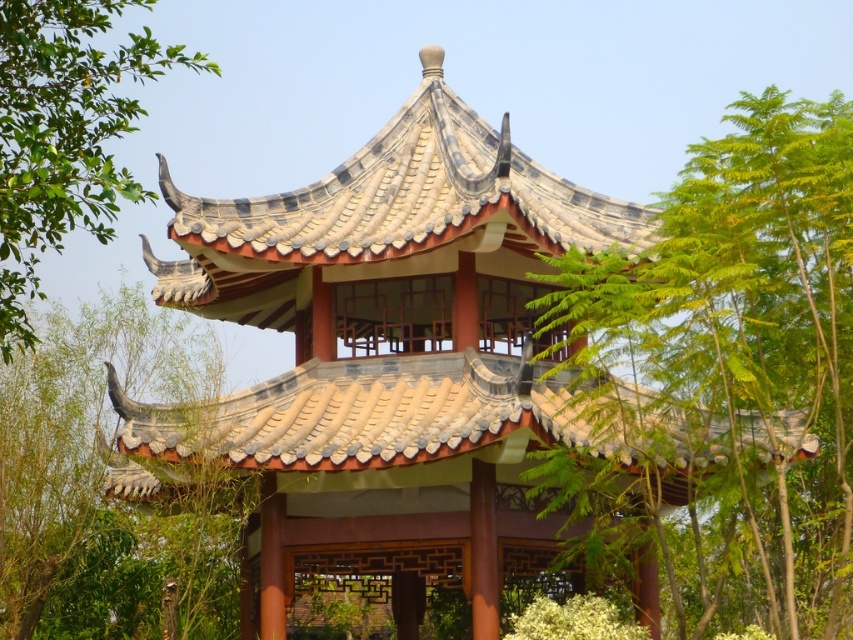
You are standing in a garden and see the green leafy tree at center and the brown textured roof at upper center. Which object is located higher in the image?

The brown textured roof at upper center is located higher in the image than the green leafy tree at center.

You are an architect designing a garden layout. You have two green leafy trees to place in the garden. The green leafy tree at center and the green leafy tree at upper left. Based on their sizes, which tree should be placed closer to the traditional Chinese pavilion to ensure it doesn

The green leafy tree at center is smaller compared to the green leafy tree at upper left. Therefore, the smaller green leafy tree at center should be placed closer to the traditional Chinese pavilion to maintain a balanced visual composition without overwhelming the structure.

You are standing in front of the traditional Chinese pavilion and notice a green leafy tree. Where is the green leafy tree at center located in relation to the pavilion?

The green leafy tree at center is located at the coordinates point (723,378).